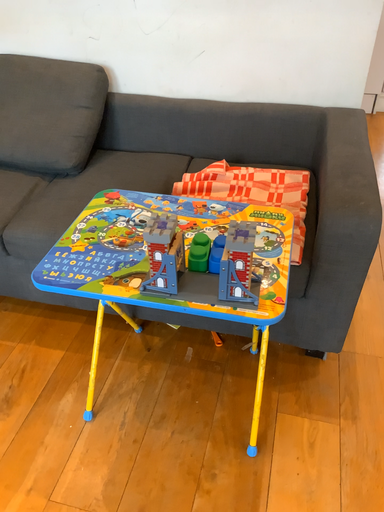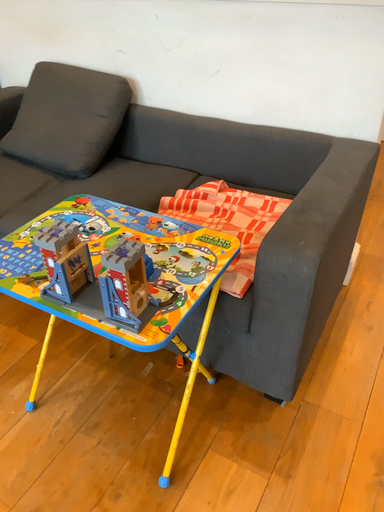
Question: How did the camera likely rotate when shooting the video?

Choices:
 (A) rotated right
 (B) rotated left

Answer: (B)